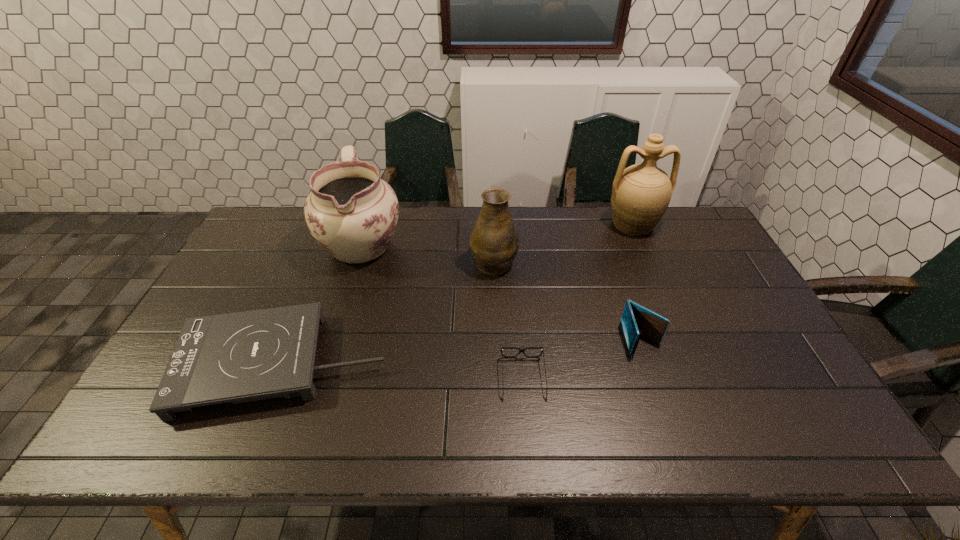
Locate an element on the screen. The image size is (960, 540). vacant space that is in between the spectacles and the second pitcher from right to left is located at coordinates (509, 320).

Locate which object ranks fourth in proximity to the leftmost pitcher. Please provide its 2D coordinates. Your answer should be formatted as a tuple, i.e. [(x, y)], where the tuple contains the x and y coordinates of a point satisfying the conditions above.

[(636, 321)]

Where is `object that stands as the fifth closest to the second pitcher from right to left`? Image resolution: width=960 pixels, height=540 pixels. object that stands as the fifth closest to the second pitcher from right to left is located at coordinates (636, 321).

You are a GUI agent. You are given a task and a screenshot of the screen. Output one action in this format:
    pyautogui.click(x=<x>, y=<y>)
    Task: Click on the pitcher that is the second closest to the wallet
    This screenshot has width=960, height=540.
    Given the screenshot: What is the action you would take?
    pyautogui.click(x=641, y=193)

Point out which pitcher is positioned as the second nearest to the shortest object. Please provide its 2D coordinates. Your answer should be formatted as a tuple, i.e. [(x, y)], where the tuple contains the x and y coordinates of a point satisfying the conditions above.

[(352, 213)]

At what (x,y) coordinates should I click in order to perform the action: click on vacant space that satisfies the following two spatial constraints: 1. on the handle side of the rightmost pitcher; 2. on the left side of the second pitcher from right to left. Please return your answer as a coordinate pair (x, y). Looking at the image, I should click on (492, 224).